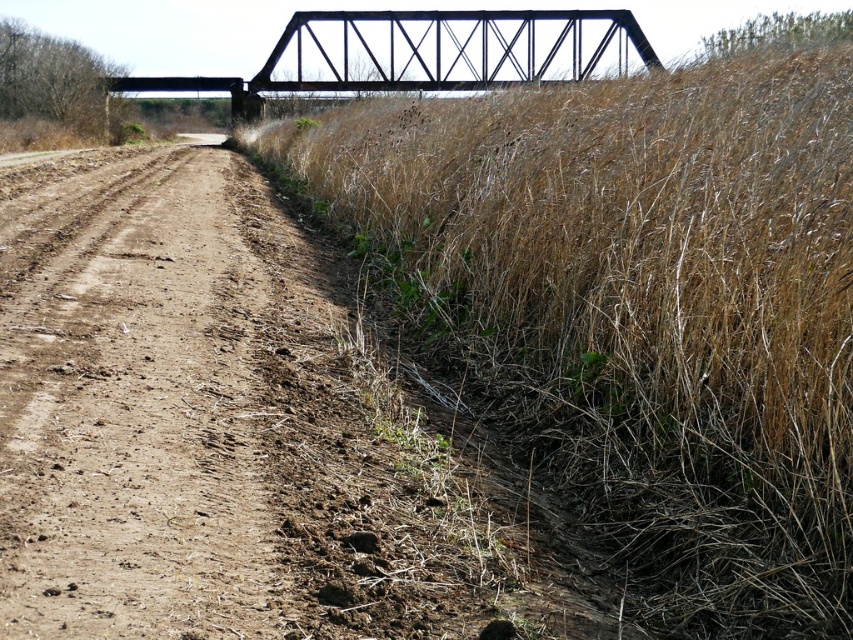
In the scene shown: You are a hiker planning to cross the black metal bridge at upper center. You see the brown dirt track at left. Which direction should you go to reach the bridge from the track?

The brown dirt track at left is located below the black metal bridge at upper center, so you should head upwards from the track to reach the bridge.

You are a hiker planning to cross the metal truss bridge in the background. You need to know if the dry grass at upper right is wider than the brown dirt track at left to decide the best path. Can you determine which is wider?

The dry grass at upper right might be wider than brown dirt track at left according to the description, so it could be a wider path for crossing.

You are standing at the point labeled as point (138, 433) in the image, which is on the brown dirt track at left. You want to walk to the metal truss bridge in the background. Which direction should you face to head towards the bridge?

You should face towards the direction of the metal truss bridge in the background because the point (138, 433) corresponds to the brown dirt track at left, which likely leads towards the bridge in the distance.